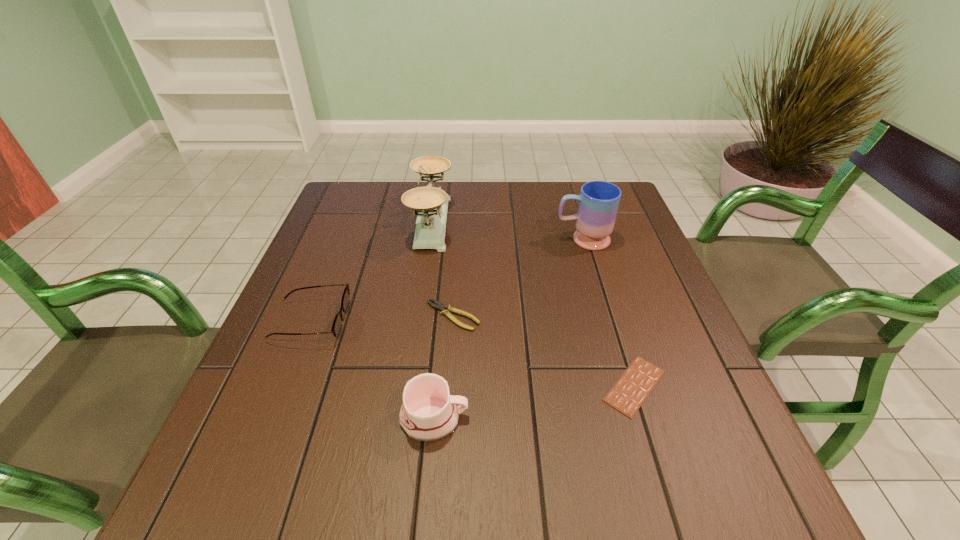
Locate an element on the screen. The height and width of the screenshot is (540, 960). vacant space located 0.360m on the side of the right mug with the handle is located at coordinates (422, 240).

Identify the location of vacant position located 0.240m on the side of the right mug with the handle. This screenshot has height=540, width=960. tap(467, 240).

The image size is (960, 540). Find the location of `vacant area situated on the side of the right mug with the handle`. vacant area situated on the side of the right mug with the handle is located at coordinates (521, 240).

Where is `vacant space located 0.140m on the side with the handle of the left mug`? This screenshot has height=540, width=960. vacant space located 0.140m on the side with the handle of the left mug is located at coordinates (546, 418).

What are the coordinates of `vacant space situated 0.190m on the face of the leftmost object` in the screenshot? It's located at (431, 321).

Identify the location of vacant space located 0.250m on the front of the fifth tallest object. The width and height of the screenshot is (960, 540). click(445, 440).

Identify the location of vacant position located 0.130m on the back of the chocolate bar. (611, 311).

I want to click on object situated at the far edge, so (x=430, y=203).

This screenshot has width=960, height=540. What are the coordinates of `object that is at the left edge` in the screenshot? It's located at (337, 325).

Where is `mug present at the right edge`? mug present at the right edge is located at coordinates (598, 205).